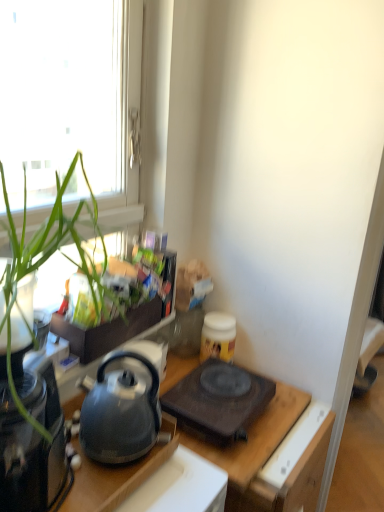
Question: Is black matte gas stove at center taller than green leafy plant at left?

Choices:
 (A) yes
 (B) no

Answer: (B)

Question: Is black matte gas stove at center facing towards green leafy plant at left?

Choices:
 (A) no
 (B) yes

Answer: (A)

Question: From a real-world perspective, is black matte gas stove at center positioned under green leafy plant at left based on gravity?

Choices:
 (A) no
 (B) yes

Answer: (B)

Question: Is green leafy plant at left at the back of black matte gas stove at center?

Choices:
 (A) no
 (B) yes

Answer: (A)

Question: From the image's perspective, does black matte gas stove at center appear lower than green leafy plant at left?

Choices:
 (A) no
 (B) yes

Answer: (B)

Question: In the image, is matte black kettle at left positioned in front of or behind green leafy plant at left?

Choices:
 (A) front
 (B) behind

Answer: (B)

Question: Is point (120, 442) closer or farther from the camera than point (46, 230)?

Choices:
 (A) farther
 (B) closer

Answer: (A)

Question: Visually, is matte black kettle at left positioned to the left or to the right of green leafy plant at left?

Choices:
 (A) right
 (B) left

Answer: (A)

Question: Is matte black kettle at left bigger or smaller than green leafy plant at left?

Choices:
 (A) small
 (B) big

Answer: (A)

Question: Considering their positions, is black glass coffee maker at left located in front of or behind transparent glass window at upper left?

Choices:
 (A) behind
 (B) front

Answer: (B)

Question: Is black glass coffee maker at left spatially inside transparent glass window at upper left, or outside of it?

Choices:
 (A) inside
 (B) outside

Answer: (B)

Question: Would you say black glass coffee maker at left is to the left or to the right of transparent glass window at upper left in the picture?

Choices:
 (A) right
 (B) left

Answer: (B)

Question: In terms of height, does black glass coffee maker at left look taller or shorter compared to transparent glass window at upper left?

Choices:
 (A) short
 (B) tall

Answer: (A)

Question: Is matte black kettle at center situated inside transparent glass window at upper left or outside?

Choices:
 (A) inside
 (B) outside

Answer: (B)

Question: From the image's perspective, is matte black kettle at center positioned above or below transparent glass window at upper left?

Choices:
 (A) above
 (B) below

Answer: (B)